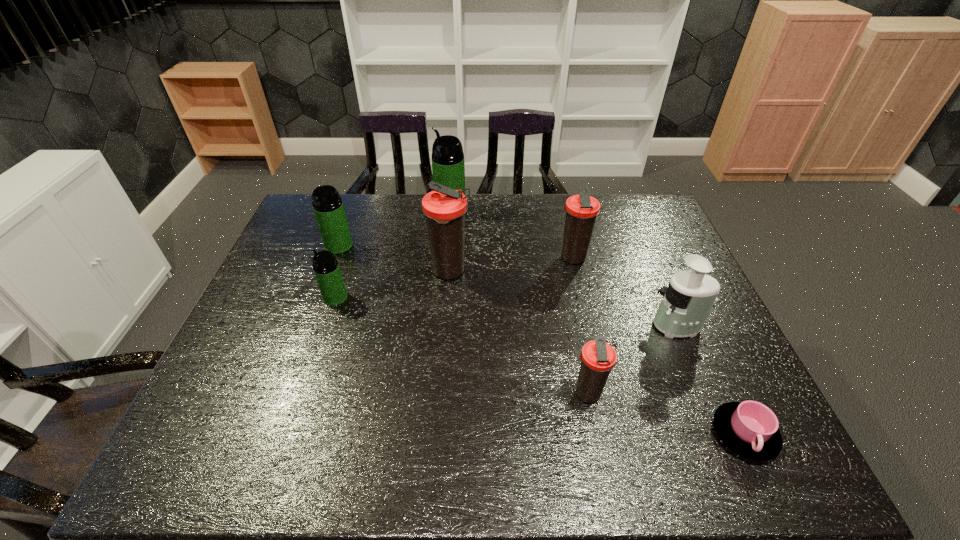
Locate an element on the screen. free spot located 0.070m from the spout of the fifth farthest object is located at coordinates (299, 298).

Identify the location of vacant space situated 0.120m from the spout of the fifth farthest object. This screenshot has height=540, width=960. (281, 298).

In order to click on vacant space located 0.390m on the left of the smallest brown thermos bottle in this screenshot , I will do point(400,394).

Where is `object that is at the far edge`? object that is at the far edge is located at coordinates (448, 168).

Find the location of a particular element. Image resolution: width=960 pixels, height=540 pixels. object that is at the near edge is located at coordinates 749,428.

Locate an element on the screen. The image size is (960, 540). object that is positioned at the left edge is located at coordinates (328, 207).

Find the location of a particular element. juicer at the right edge is located at coordinates (687, 301).

This screenshot has width=960, height=540. What are the coordinates of `cup that is at the right edge` in the screenshot? It's located at (749, 428).

Where is `object at the near right corner`? Image resolution: width=960 pixels, height=540 pixels. object at the near right corner is located at coordinates coord(749,428).

What are the coordinates of `vacant space at the far edge of the desktop` in the screenshot? It's located at (605, 198).